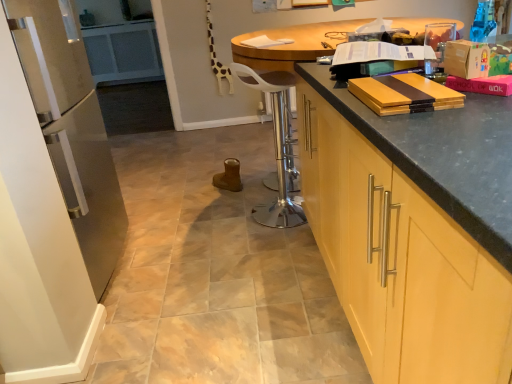
Question: Considering their positions, is matte yellow wood book at upper right, the 3th book in the bottom-to-top sequence, located in front of or behind white paper at center, the first book viewed from the top?

Choices:
 (A) behind
 (B) front

Answer: (B)

Question: Is matte yellow wood book at upper right, which appears as the 2th book when viewed from the back, inside the boundaries of white paper at center, which ranks as the 1th book in back-to-front order, or outside?

Choices:
 (A) outside
 (B) inside

Answer: (A)

Question: Estimate the real-world distances between objects in this image. Which object is farther from the matte yellow wood book at upper right, which appears as the 2th book when viewed from the back?

Choices:
 (A) yellow wood cabinet at right
 (B) yellow wood cutting board at upper right, the fourth book from the back
 (C) white paper at center, the first book viewed from the top
 (D) matte black countertop at right
 (E) matte cardboard book at upper right, the second book positioned from the front

Answer: (C)

Question: Estimate the real-world distances between objects in this image. Which object is closer to the matte yellow wood book at upper right, the 3th book in the bottom-to-top sequence?

Choices:
 (A) matte cardboard book at upper right, the third book viewed from the top
 (B) white paper at center, which ranks as the 1th book in back-to-front order
 (C) matte black countertop at right
 (D) yellow wood cabinet at right
 (E) metallic silver bar stool at center

Answer: (C)